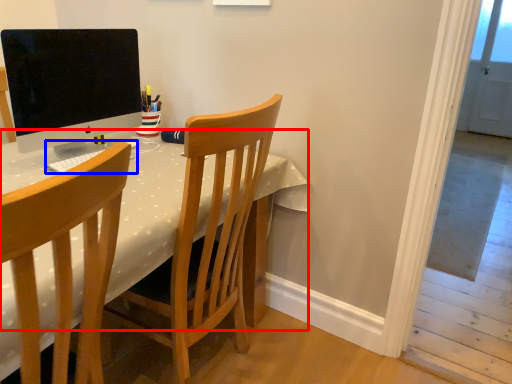
Question: Which of the following is the farthest to the observer, table (highlighted by a red box) or computer keyboard (highlighted by a blue box)?

Choices:
 (A) table
 (B) computer keyboard

Answer: (B)